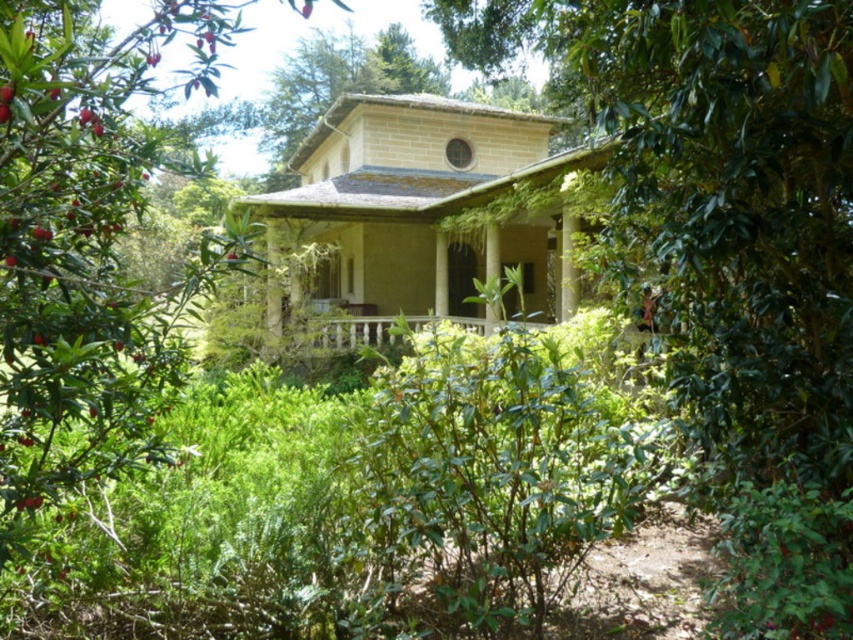
Which is above, green leafy tree at center or green leafy bush at center?

green leafy tree at center is above.

Is point (636, 227) farther from viewer compared to point (190, 0)?

Yes, point (636, 227) is farther from viewer.

Where is `green leafy tree at center`? The height and width of the screenshot is (640, 853). green leafy tree at center is located at coordinates (729, 257).

Which of these two, green leafy bush at center or wooden porch at center, stands shorter?

wooden porch at center is shorter.

Locate an element on the screen. Image resolution: width=853 pixels, height=640 pixels. green leafy bush at center is located at coordinates (84, 250).

Image resolution: width=853 pixels, height=640 pixels. What do you see at coordinates (84, 250) in the screenshot? I see `green leafy bush at center` at bounding box center [84, 250].

I want to click on green leafy bush at center, so click(x=84, y=250).

Is green leafy tree at center taller than wooden porch at center?

Correct, green leafy tree at center is much taller as wooden porch at center.

Is green leafy tree at center shorter than wooden porch at center?

In fact, green leafy tree at center may be taller than wooden porch at center.

Where is `green leafy tree at center`? The image size is (853, 640). green leafy tree at center is located at coordinates (729, 257).